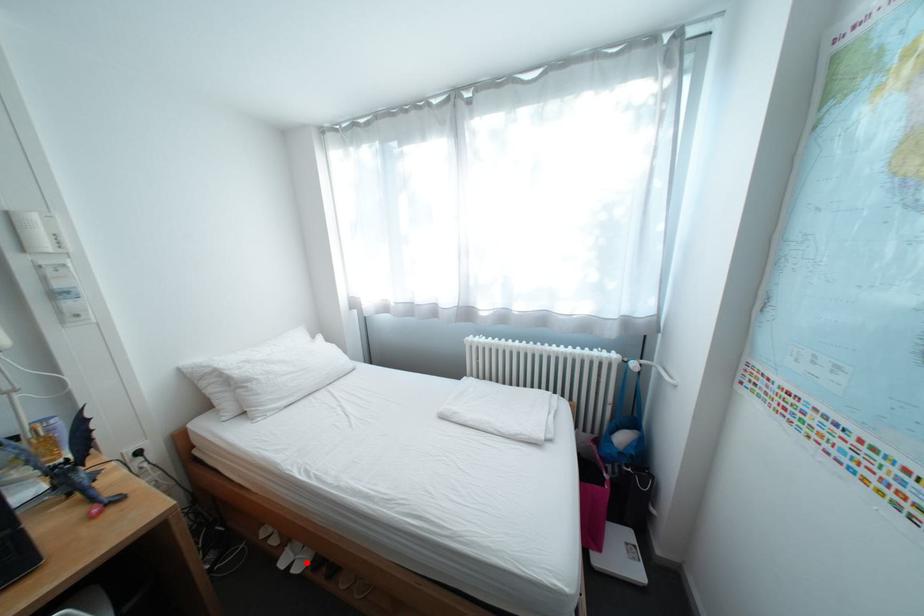
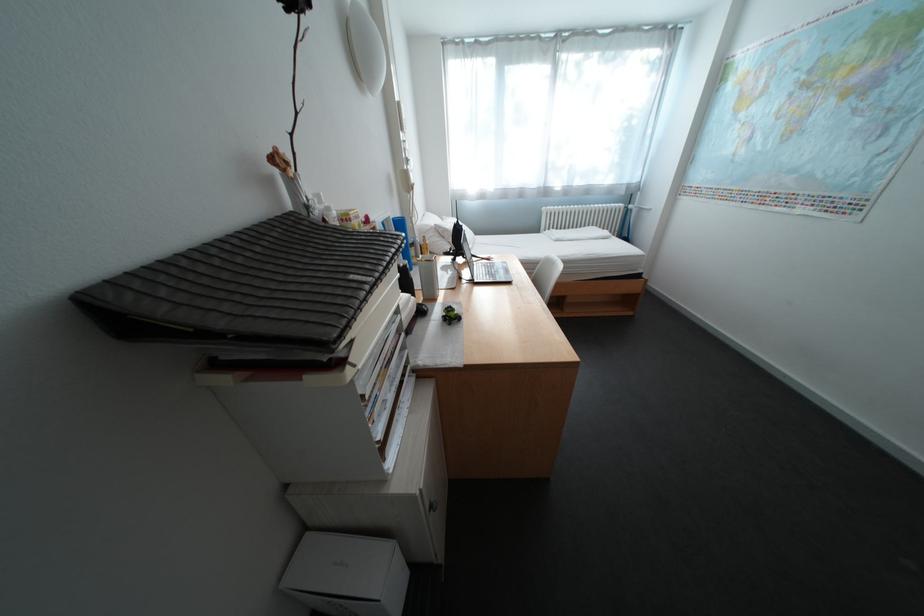
Question: I am providing you with two images of the same scene from different viewpoints. A red point is marked on the first image. Is the red point's position out of view in image 2?

Choices:
 (A) Yes
 (B) No

Answer: (A)